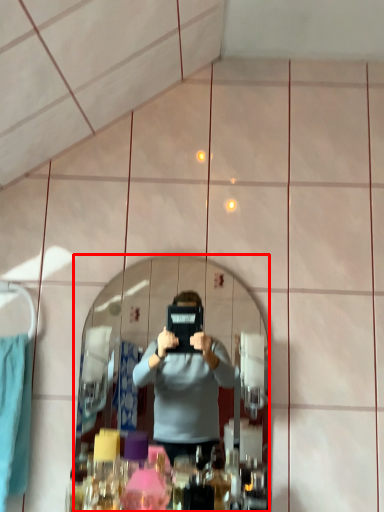
Question: Considering the relative positions of mirror (annotated by the red box) and clothe in the image provided, where is mirror (annotated by the red box) located with respect to the staircase?

Choices:
 (A) right
 (B) left

Answer: (A)